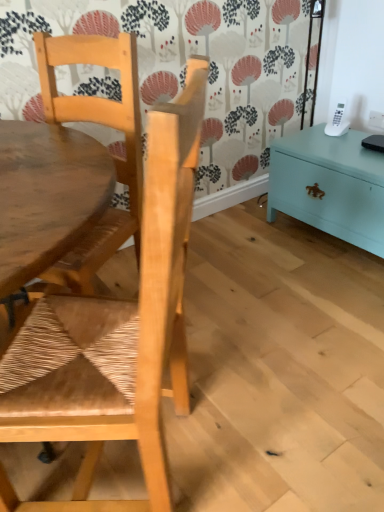
Locate an element on the screen. Image resolution: width=384 pixels, height=512 pixels. vacant space situated above teal painted wood chest at right (from a real-world perspective) is located at coordinates (346, 146).